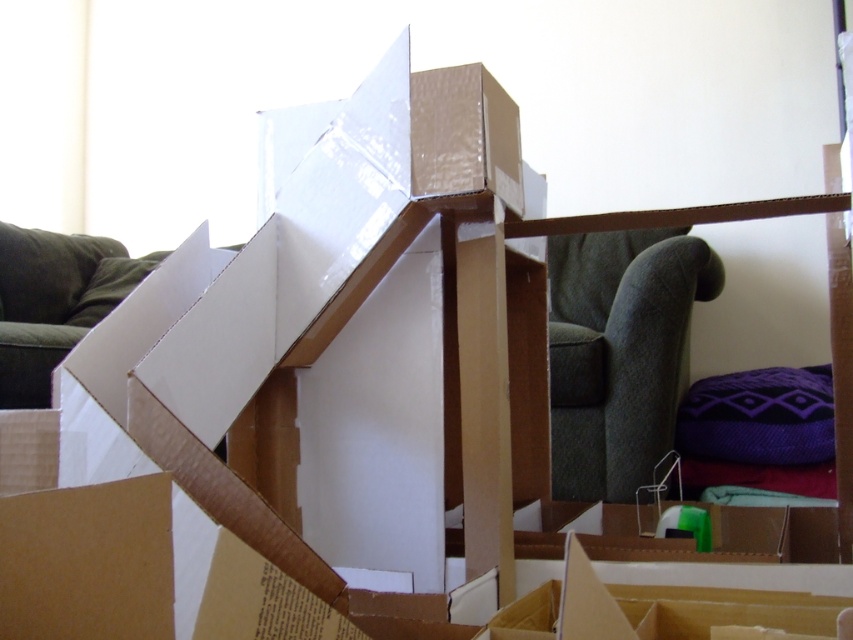
Who is more distant from viewer, (662, 448) or (7, 259)?

Point (7, 259)

Does dark green fabric armchair at center appear on the right side of green fabric couch at left?

Correct, you'll find dark green fabric armchair at center to the right of green fabric couch at left.

Is point (561, 340) less distant than point (48, 323)?

Yes, point (561, 340) is in front of point (48, 323).

Identify the location of dark green fabric armchair at center. (619, 353).